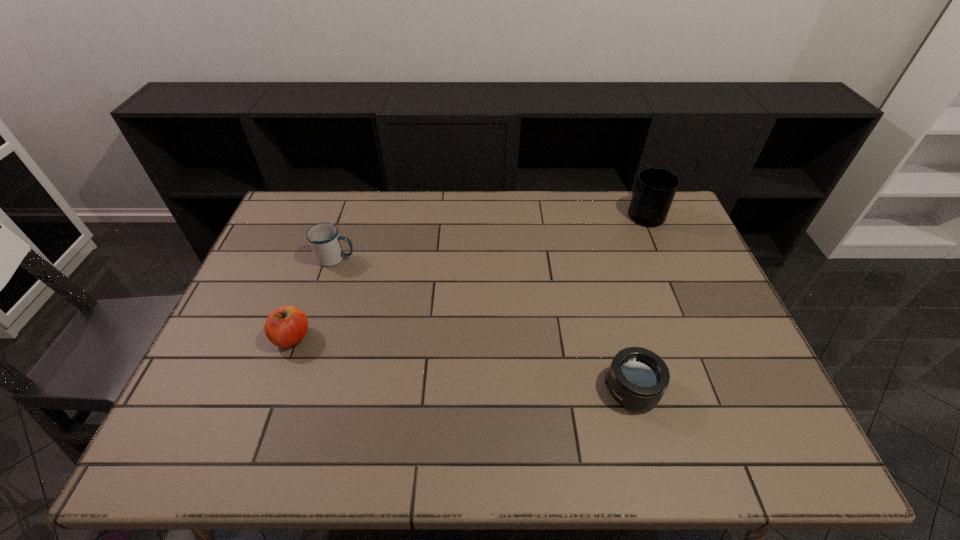
This screenshot has height=540, width=960. I want to click on vacant space at the far left corner, so click(333, 202).

At what (x,y) coordinates should I click in order to perform the action: click on vacant position at the near right corner of the desktop. Please return your answer as a coordinate pair (x, y). Looking at the image, I should click on (743, 438).

Identify the location of vacant region between the taller mug and the nearest object. This screenshot has width=960, height=540. (638, 301).

Identify the location of free spot between the tallest object and the apple. The image size is (960, 540). (468, 275).

You are a GUI agent. You are given a task and a screenshot of the screen. Output one action in this format:
    pyautogui.click(x=<x>, y=<y>)
    Task: Click on the free area in between the second farthest object and the tallest object
    
    Given the screenshot: What is the action you would take?
    pyautogui.click(x=491, y=235)

Identify the location of free space between the farther mug and the apple. (468, 275).

The image size is (960, 540). What are the coordinates of `free space between the second object from right to left and the taller mug` in the screenshot? It's located at (638, 301).

Where is `free area in between the apple and the second farthest object`? The width and height of the screenshot is (960, 540). free area in between the apple and the second farthest object is located at coordinates (314, 298).

Locate an element on the screen. This screenshot has height=540, width=960. free point between the second object from right to left and the second nearest object is located at coordinates (462, 363).

At what (x,y) coordinates should I click in order to perform the action: click on free area in between the left mug and the third object from left to right. Please return your answer as a coordinate pair (x, y). This screenshot has width=960, height=540. Looking at the image, I should click on (484, 324).